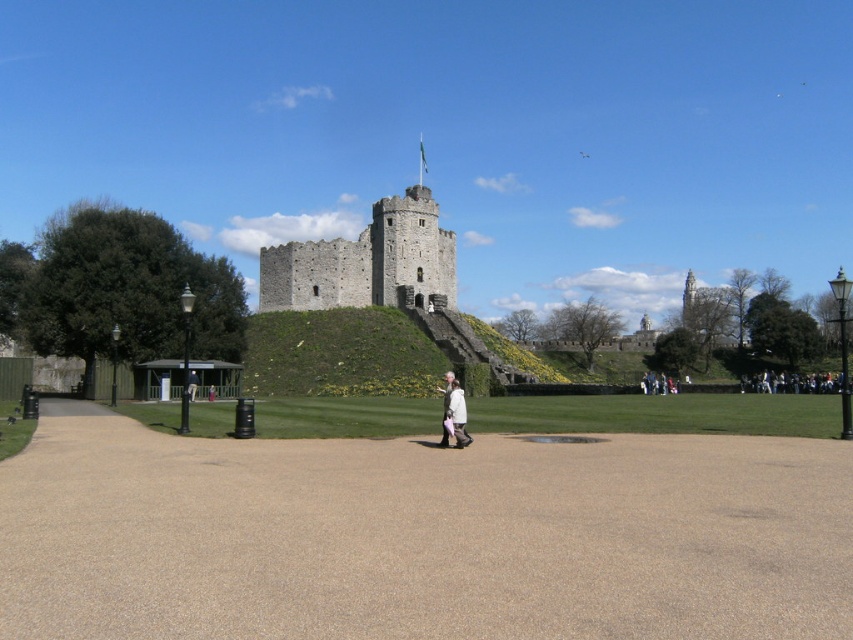
Question: Which object appears farthest from the camera in this image?

Choices:
 (A) brown gravel path at center
 (B) brown leather jacket at center

Answer: (B)

Question: Does brown gravel path at center come in front of brown leather jacket at center?

Choices:
 (A) no
 (B) yes

Answer: (B)

Question: From the image, what is the correct spatial relationship of brown gravel path at center in relation to gray stone castle at center?

Choices:
 (A) left
 (B) right

Answer: (B)

Question: Does gray stone castle at center come behind white fabric at center?

Choices:
 (A) no
 (B) yes

Answer: (B)

Question: Considering the real-world distances, which object is closest to the white fabric at center?

Choices:
 (A) brown leather jacket at center
 (B) gray stone castle at center
 (C) brown gravel path at center

Answer: (C)

Question: Which point is closer to the camera?

Choices:
 (A) (779, 524)
 (B) (456, 408)
 (C) (396, 243)
 (D) (192, 369)

Answer: (A)